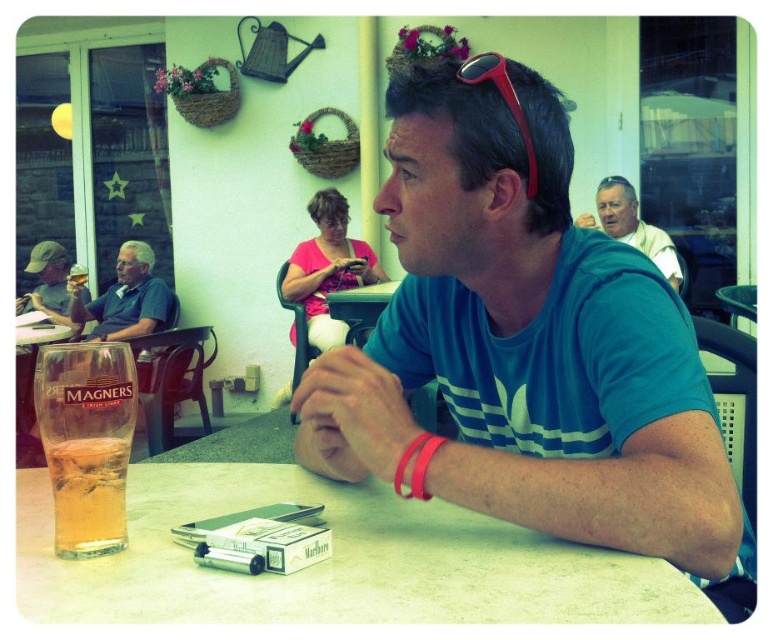
Question: Which is nearer to the matte gray cap at left?

Choices:
 (A) blue cotton shirt at upper left
 (B) white plastic table at center

Answer: (A)

Question: Is clear plastic table at center smaller than matte gray cap at left?

Choices:
 (A) no
 (B) yes

Answer: (B)

Question: Which point is closer to the camera?

Choices:
 (A) (90, 545)
 (B) (41, 291)
 (C) (145, 333)

Answer: (A)

Question: Where is blue cotton shirt at upper left located in relation to white textured shirt at upper right in the image?

Choices:
 (A) above
 (B) below

Answer: (B)

Question: Does clear plastic table at center have a larger size compared to white textured shirt at upper right?

Choices:
 (A) yes
 (B) no

Answer: (B)

Question: Which object is positioned closest to the clear plastic table at center?

Choices:
 (A) blue fabric shirt at center
 (B) blue cotton shirt at upper left
 (C) white textured shirt at upper right

Answer: (A)